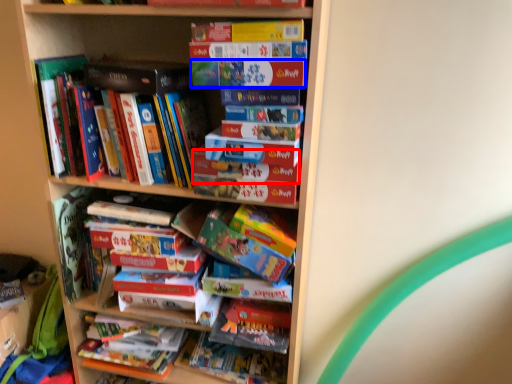
Question: Which of the following is the closest to the observer, paperback book (highlighted by a red box) or paperback book (highlighted by a blue box)?

Choices:
 (A) paperback book
 (B) paperback book

Answer: (B)